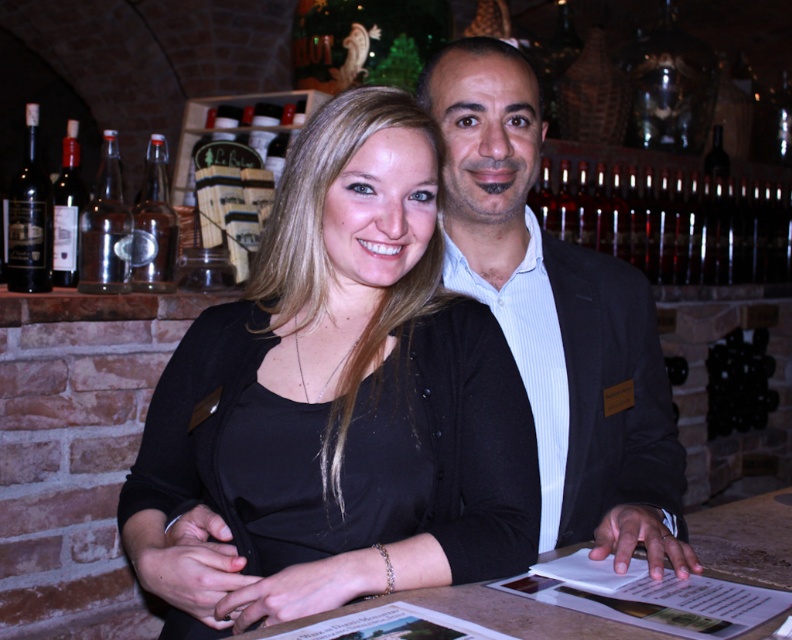
Does matte black suit at center have a smaller size compared to dark red glass bottle at left?

No.

Who is more forward, (581, 292) or (29, 236)?

Positioned in front is point (581, 292).

The image size is (792, 640). What do you see at coordinates (558, 317) in the screenshot?
I see `matte black suit at center` at bounding box center [558, 317].

The width and height of the screenshot is (792, 640). Identify the location of matte black suit at center. (558, 317).

Is black matte shirt at center wider than clear glass bottle at center?

Yes, black matte shirt at center is wider than clear glass bottle at center.

You are a GUI agent. You are given a task and a screenshot of the screen. Output one action in this format:
    pyautogui.click(x=<x>, y=<y>)
    Task: Click on the black matte shirt at center
    The image size is (792, 640).
    Given the screenshot: What is the action you would take?
    pyautogui.click(x=334, y=401)

Describe the element at coordinates (334, 401) in the screenshot. I see `black matte shirt at center` at that location.

Identify the location of black matte shirt at center. (334, 401).

Consider the image. Is black matte shirt at center bigger than matte black suit at center?

No, black matte shirt at center is not bigger than matte black suit at center.

Is black matte shirt at center taller than matte black suit at center?

No, black matte shirt at center is not taller than matte black suit at center.

The width and height of the screenshot is (792, 640). I want to click on black matte shirt at center, so click(334, 401).